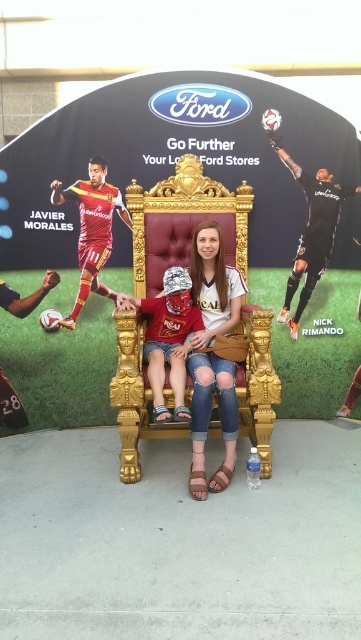
Consider the image. Between denim jeans at center and matte red shirt at center, which one appears on the right side from the viewer's perspective?

From the viewer's perspective, denim jeans at center appears more on the right side.

Does denim jeans at center have a greater width compared to matte red shirt at center?

In fact, denim jeans at center might be narrower than matte red shirt at center.

Identify the location of denim jeans at center. (212, 355).

Does denim jeans at center lie behind matte red soccer jersey at left?

That is False.

Which of these two, denim jeans at center or matte red soccer jersey at left, stands shorter?

matte red soccer jersey at left

The image size is (361, 640). Find the location of `denim jeans at center`. denim jeans at center is located at coordinates pos(212,355).

Between matte red jersey at upper left and matte red shirt at center, which one is positioned higher?

Positioned higher is matte red jersey at upper left.

Is matte red jersey at upper left closer to the viewer compared to matte red shirt at center?

That is False.

Identify the location of matte red jersey at upper left. (179, 248).